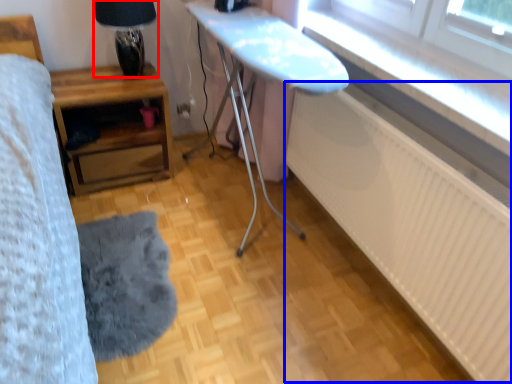
Question: Which point is further to the camera, table lamp (highlighted by a red box) or radiator (highlighted by a blue box)?

Choices:
 (A) table lamp
 (B) radiator

Answer: (A)